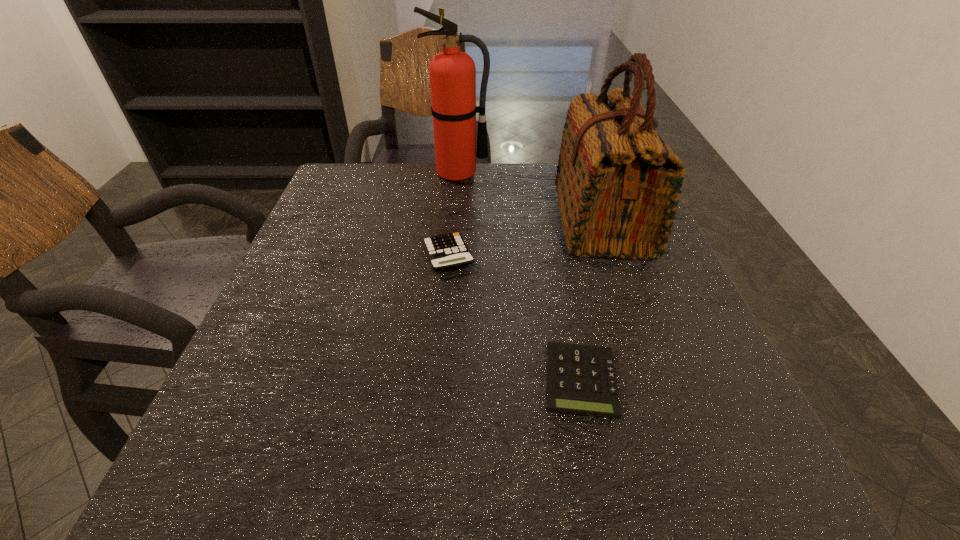
Find the location of a particular element. The width and height of the screenshot is (960, 540). free space between the shortest object and the taller calculator is located at coordinates (515, 319).

At what (x,y) coordinates should I click in order to perform the action: click on vacant space that is in between the farthest object and the shortest object. Please return your answer as a coordinate pair (x, y). Image resolution: width=960 pixels, height=540 pixels. Looking at the image, I should click on [x=519, y=277].

Where is `object that can be found as the third closest to the farthest object`? Image resolution: width=960 pixels, height=540 pixels. object that can be found as the third closest to the farthest object is located at coordinates (581, 379).

Where is `object that is the third nearest to the farthest object`? The height and width of the screenshot is (540, 960). object that is the third nearest to the farthest object is located at coordinates (581, 379).

Identify the location of vacant space that satisfies the following two spatial constraints: 1. at the nozzle of the nearer calculator; 2. on the left side of the fire extinguisher. (443, 381).

In order to click on vacant space that satisfies the following two spatial constraints: 1. on the open handle side of the shopping bag; 2. on the front side of the farther calculator in this screenshot , I will do `click(615, 256)`.

At what (x,y) coordinates should I click in order to perform the action: click on free point that satisfies the following two spatial constraints: 1. at the nozzle of the nearer calculator; 2. on the left side of the fire extinguisher. Please return your answer as a coordinate pair (x, y). The height and width of the screenshot is (540, 960). Looking at the image, I should click on (443, 381).

Find the location of a particular element. The image size is (960, 540). free location that satisfies the following two spatial constraints: 1. at the nozzle of the farthest object; 2. on the left side of the shortest object is located at coordinates (443, 381).

The height and width of the screenshot is (540, 960). Identify the location of free region that satisfies the following two spatial constraints: 1. at the nozzle of the nearer calculator; 2. on the left side of the fire extinguisher. (443, 381).